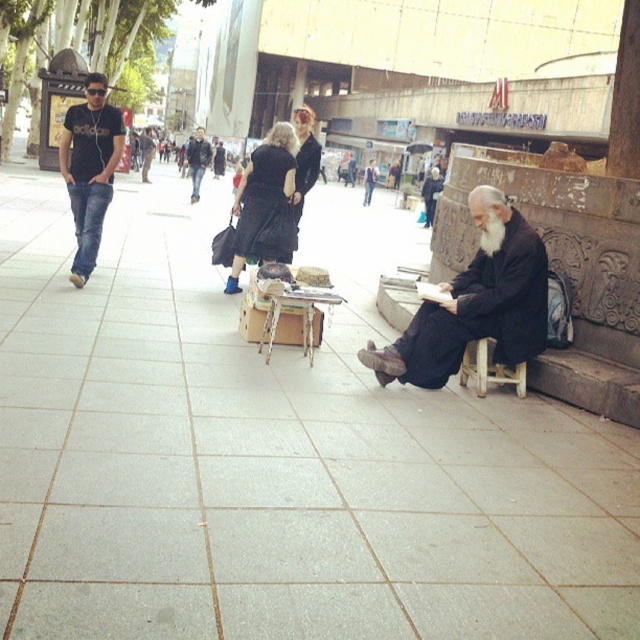
Is black matte dress at center to the right of white fluffy beard at lower right from the viewer's perspective?

In fact, black matte dress at center is to the left of white fluffy beard at lower right.

Where is `black matte dress at center`? black matte dress at center is located at coordinates (266, 204).

Identify the location of black matte dress at center. (266, 204).

In the scene shown: Between black matte dress at center and black matte robe at center, which one has more height?

black matte dress at center

Does black matte dress at center appear under black matte robe at center?

Indeed, black matte dress at center is positioned under black matte robe at center.

Between point (273, 220) and point (310, 157), which one is positioned in front?

Point (273, 220) is in front.

Locate an element on the screen. This screenshot has height=640, width=640. black matte dress at center is located at coordinates (266, 204).

Does black matte robe at lower right appear under wooden at lower right?

No.

Between black matte robe at lower right and wooden at lower right, which one has less height?

wooden at lower right is shorter.

Describe the element at coordinates (483, 308) in the screenshot. The image size is (640, 640). I see `black matte robe at lower right` at that location.

You are a GUI agent. You are given a task and a screenshot of the screen. Output one action in this format:
    pyautogui.click(x=<x>, y=<y>)
    Task: Click on the black matte robe at lower right
    
    Given the screenshot: What is the action you would take?
    pyautogui.click(x=483, y=308)